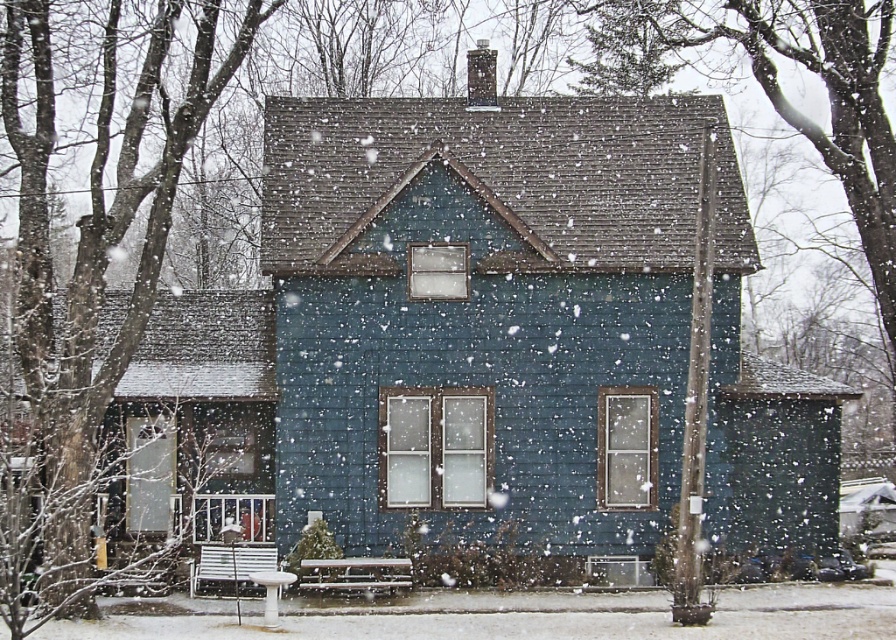
Question: Is metallic silver bench at lower center bigger than white plastic park bench at lower left?

Choices:
 (A) yes
 (B) no

Answer: (A)

Question: Which point is farther to the camera?

Choices:
 (A) (351, 564)
 (B) (194, 582)

Answer: (B)

Question: Is metallic silver bench at lower center smaller than white plastic park bench at lower left?

Choices:
 (A) no
 (B) yes

Answer: (A)

Question: Which point is closer to the camera taking this photo?

Choices:
 (A) (190, 589)
 (B) (349, 580)

Answer: (A)

Question: Where is metallic silver bench at lower center located in relation to white plastic park bench at lower left in the image?

Choices:
 (A) right
 (B) left

Answer: (A)

Question: Which point is closer to the camera?

Choices:
 (A) (220, 557)
 (B) (306, 563)

Answer: (B)